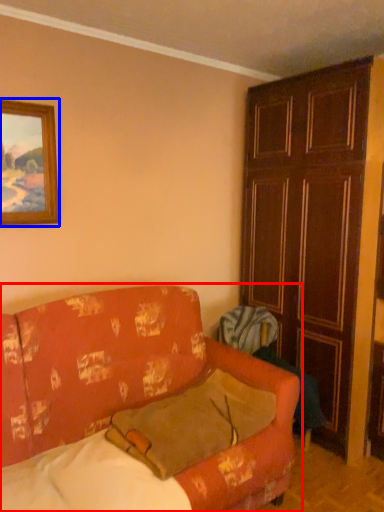
Question: Which point is closer to the camera, studio couch (highlighted by a red box) or picture frame (highlighted by a blue box)?

Choices:
 (A) studio couch
 (B) picture frame

Answer: (A)